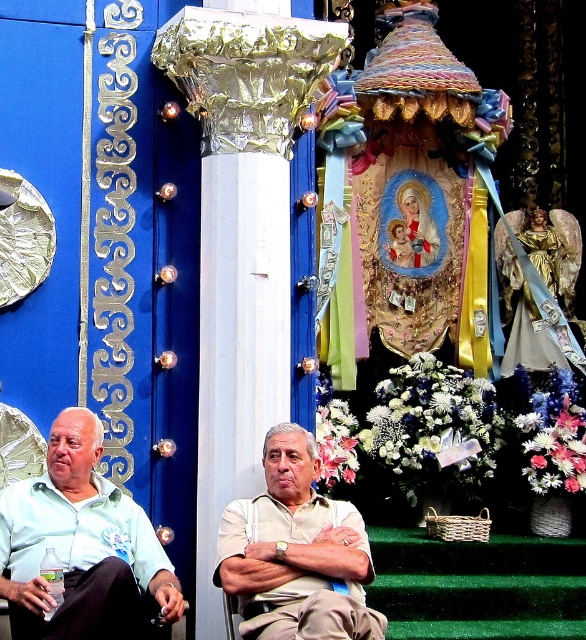
Looking at this image, who is more distant from viewer, (86,520) or (357,609)?

The point (86,520) is behind.

Between light green fabric shirt at center and light beige cotton shirt at center, which one is positioned higher?

light green fabric shirt at center is higher up.

Is point (168, 612) in front of point (230, 548)?

Yes, point (168, 612) is in front of point (230, 548).

This screenshot has width=586, height=640. I want to click on light green fabric shirt at center, so click(x=80, y=545).

Which is in front, point (364, 561) or point (63, 433)?

Point (364, 561)

This screenshot has height=640, width=586. Find the location of `light green fabric shirt at center`. light green fabric shirt at center is located at coordinates pyautogui.click(x=80, y=545).

Is point (169, 577) closer to viewer compared to point (28, 480)?

Yes.

Where is `light green fabric shirt at center`? light green fabric shirt at center is located at coordinates (80, 545).

Between light blue cotton shirt at center and light beige cotton shirt at center, which one has more height?

light blue cotton shirt at center is taller.

Can you confirm if light blue cotton shirt at center is wider than light beige cotton shirt at center?

Indeed, light blue cotton shirt at center has a greater width compared to light beige cotton shirt at center.

The image size is (586, 640). What do you see at coordinates (80, 545) in the screenshot?
I see `light blue cotton shirt at center` at bounding box center [80, 545].

You are a GUI agent. You are given a task and a screenshot of the screen. Output one action in this format:
    pyautogui.click(x=<x>, y=<y>)
    Task: Click on the light blue cotton shirt at center
    Image resolution: width=586 pixels, height=640 pixels.
    Given the screenshot: What is the action you would take?
    pyautogui.click(x=80, y=545)